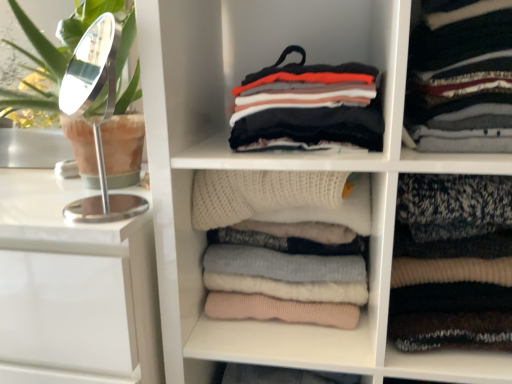
Question: Does knitted wool sweater at right, which is counted as the third clothing, starting from the left, have a lesser height compared to white glossy vanity at left?

Choices:
 (A) no
 (B) yes

Answer: (B)

Question: Is knitted wool sweater at right, which is counted as the third clothing, starting from the left, at the right side of white glossy vanity at left?

Choices:
 (A) no
 (B) yes

Answer: (B)

Question: Considering the relative sizes of knitted wool sweater at right, which is counted as the third clothing, starting from the left, and white glossy vanity at left in the image provided, is knitted wool sweater at right, which is counted as the third clothing, starting from the left, bigger than white glossy vanity at left?

Choices:
 (A) yes
 (B) no

Answer: (B)

Question: Is knitted wool sweater at right, the 1th clothing in the right-to-left sequence, beside white glossy vanity at left?

Choices:
 (A) no
 (B) yes

Answer: (A)

Question: From a real-world perspective, is knitted wool sweater at right, the 1th clothing in the right-to-left sequence, under white glossy vanity at left?

Choices:
 (A) yes
 (B) no

Answer: (B)

Question: Is knitted wool sweater at right, which is counted as the third clothing, starting from the left, not near white glossy vanity at left?

Choices:
 (A) yes
 (B) no

Answer: (B)

Question: From the image's perspective, is knit sweater at center on top of striped knit sweater at upper right, which appears as the second clothing when viewed from the right?

Choices:
 (A) no
 (B) yes

Answer: (A)

Question: Can you confirm if knit sweater at center is shorter than striped knit sweater at upper right, which appears as the second clothing when viewed from the right?

Choices:
 (A) no
 (B) yes

Answer: (A)

Question: Is knit sweater at center directly adjacent to striped knit sweater at upper right, which appears as the second clothing when viewed from the right?

Choices:
 (A) no
 (B) yes

Answer: (A)

Question: From a real-world perspective, is knit sweater at center over striped knit sweater at upper right, which appears as the second clothing when viewed from the right?

Choices:
 (A) no
 (B) yes

Answer: (A)

Question: From the image's perspective, is knit sweater at center beneath striped knit sweater at upper right, which is the 2th clothing from left to right?

Choices:
 (A) no
 (B) yes

Answer: (B)

Question: From a real-world perspective, is knit sweater at center under striped knit sweater at upper right, which is the 2th clothing from left to right?

Choices:
 (A) no
 (B) yes

Answer: (B)

Question: Is knitted wool sweater at right, which is counted as the third clothing, starting from the left, positioned with its back to white knitted sweater at center?

Choices:
 (A) no
 (B) yes

Answer: (A)